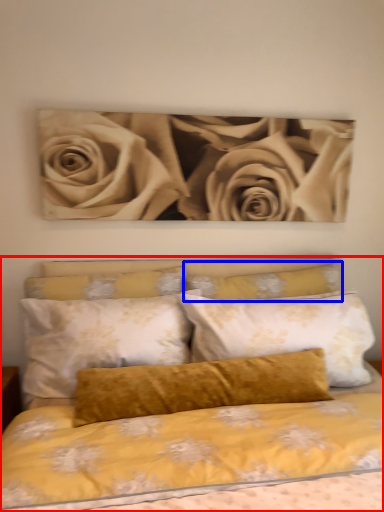
Question: Which object is closer to the camera taking this photo, bed (highlighted by a red box) or pillow (highlighted by a blue box)?

Choices:
 (A) bed
 (B) pillow

Answer: (A)